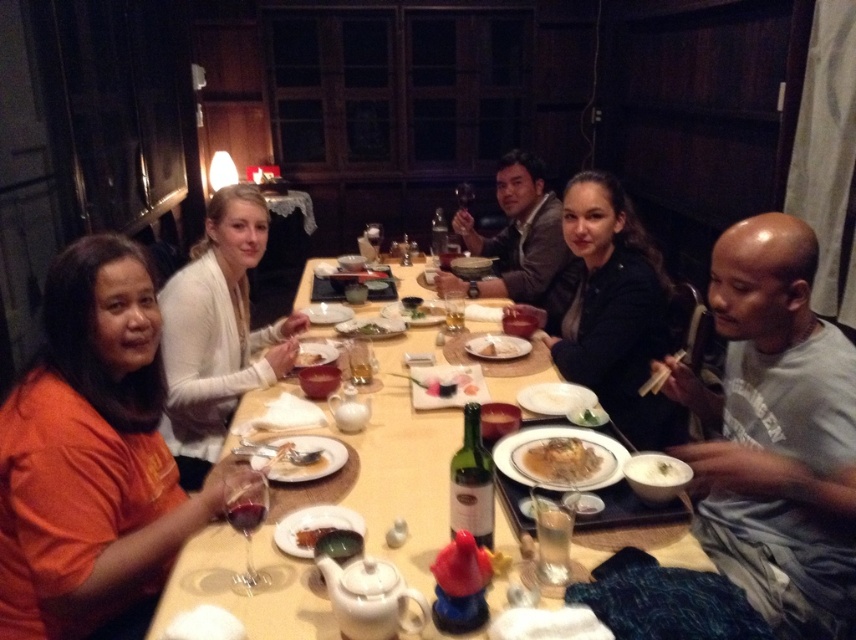
You are standing at the center of the dining table and want to pass a napkin to the person wearing the orange cotton shirt at lower left. In which direction should you move to reach them?

The orange cotton shirt at lower left is located at coordinates approximately 0.717 on the x axis and 0.110 on the y axis. Since you are at the center, you should move towards the lower left direction to reach them.

You are a photographer standing at the camera position. You want to take a closeup photo of the orange cotton shirt at lower left. Can you reach it with your camera without moving your position?

The orange cotton shirt at lower left is 1.19 meters away from camera, so yes, you can reach it with your camera without moving your position since it is within a typical camera focusing range.

You are a server in a restaurant and need to place a new dish on the table. There is a dark brown leather jacket at center and a matte ceramic bowl at center. Which object should you avoid placing the dish on to ensure it fits properly?

You should avoid placing the dish on the dark brown leather jacket at center because it is larger in size than the matte ceramic bowl at center, making it less suitable for placing dishes.